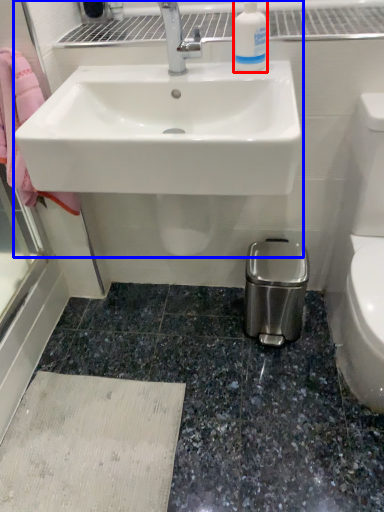
Question: Which point is further to the camera, cleaning product (highlighted by a red box) or sink (highlighted by a blue box)?

Choices:
 (A) cleaning product
 (B) sink

Answer: (A)